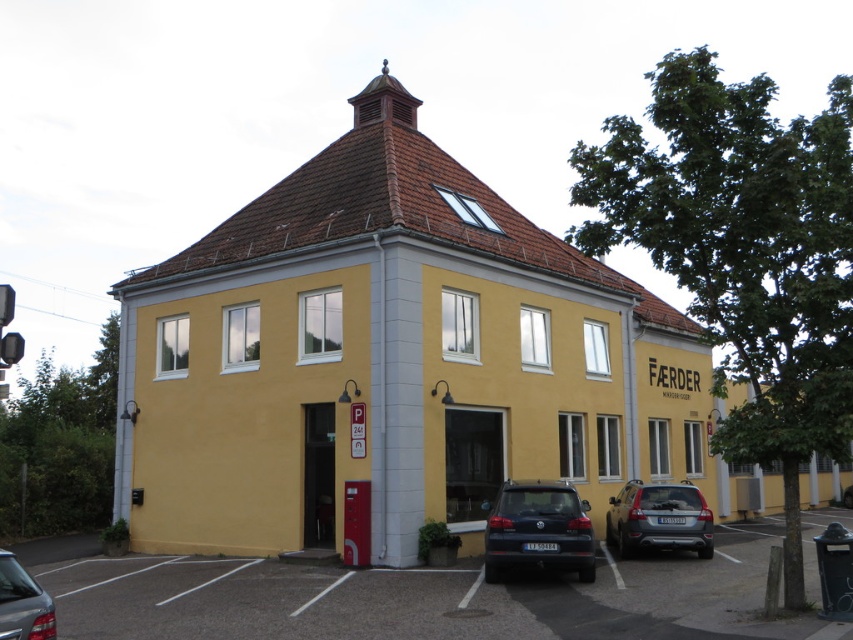
Who is positioned more to the left, matte black car at lower center or shiny silver sedan at lower left?

shiny silver sedan at lower left

Can you confirm if matte black car at lower center is positioned above shiny silver sedan at lower left?

Incorrect, matte black car at lower center is not positioned above shiny silver sedan at lower left.

The height and width of the screenshot is (640, 853). I want to click on matte black car at lower center, so click(538, 531).

Is point (686, 513) closer to viewer compared to point (6, 550)?

Yes.

Is satin silver suv at lower right positioned at the back of shiny silver sedan at lower left?

That is True.

Does point (668, 513) come farther from viewer compared to point (18, 579)?

Yes, point (668, 513) is behind point (18, 579).

Where is `satin silver suv at lower right`? satin silver suv at lower right is located at coordinates (659, 518).

From the picture: Is matte black car at lower center smaller than satin silver suv at lower right?

Yes, matte black car at lower center is smaller than satin silver suv at lower right.

Between point (560, 502) and point (691, 540), which one is positioned behind?

The point (691, 540) is behind.

Where is `matte black car at lower center`? matte black car at lower center is located at coordinates (538, 531).